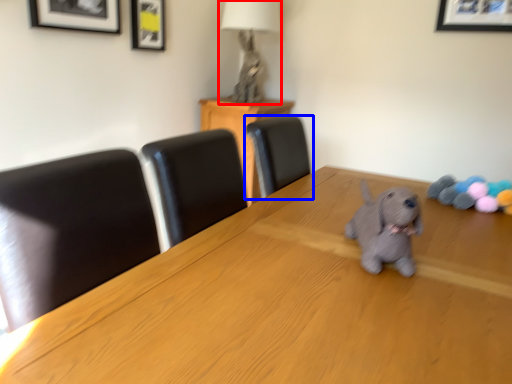
Question: Which object is further to the camera taking this photo, table lamp (highlighted by a red box) or chair (highlighted by a blue box)?

Choices:
 (A) table lamp
 (B) chair

Answer: (A)